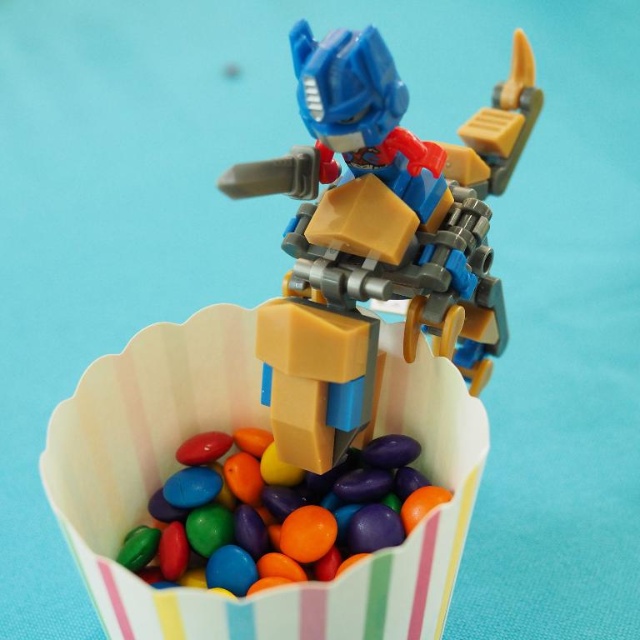
Does matte plastic robot at center have a greater width compared to glossy plastic candy at center?

Yes, matte plastic robot at center is wider than glossy plastic candy at center.

Does matte plastic robot at center have a lesser height compared to glossy plastic candy at center?

In fact, matte plastic robot at center may be taller than glossy plastic candy at center.

I want to click on matte plastic robot at center, so click(378, 236).

Image resolution: width=640 pixels, height=640 pixels. I want to click on matte plastic robot at center, so click(378, 236).